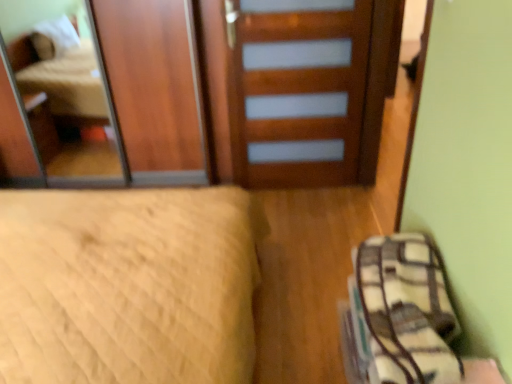
You are a GUI agent. You are given a task and a screenshot of the screen. Output one action in this format:
    pyautogui.click(x=<x>, y=<y>)
    Task: Click on the beige quilted bed at lower left
    The height and width of the screenshot is (384, 512).
    Given the screenshot: What is the action you would take?
    pyautogui.click(x=127, y=286)

Image resolution: width=512 pixels, height=384 pixels. What do you see at coordinates (56, 98) in the screenshot? I see `wooden mirror at upper left` at bounding box center [56, 98].

What do you see at coordinates (297, 90) in the screenshot?
I see `wooden door at center` at bounding box center [297, 90].

Where is `wooden door at center`? The width and height of the screenshot is (512, 384). wooden door at center is located at coordinates (297, 90).

Find the location of a particular element. The image size is (512, 384). beige quilted bed at lower left is located at coordinates (127, 286).

Considering the positions of objects beige quilted bed at lower left and plaid fabric bag at lower right in the image provided, who is more to the right, beige quilted bed at lower left or plaid fabric bag at lower right?

plaid fabric bag at lower right is more to the right.

Is beige quilted bed at lower left far away from plaid fabric bag at lower right?

No, beige quilted bed at lower left is not far away from plaid fabric bag at lower right.

Between beige quilted bed at lower left and plaid fabric bag at lower right, which one has more height?

Standing taller between the two is beige quilted bed at lower left.

In the scene shown: Considering the sizes of plaid fabric bag at lower right and wooden door at center in the image, is plaid fabric bag at lower right taller or shorter than wooden door at center?

In the image, plaid fabric bag at lower right appears to be shorter than wooden door at center.

Is plaid fabric bag at lower right aimed at wooden door at center?

No, plaid fabric bag at lower right is not facing towards wooden door at center.

Does plaid fabric bag at lower right appear on the left side of wooden door at center?

In fact, plaid fabric bag at lower right is to the right of wooden door at center.

From a real-world perspective, which is physically above, plaid fabric bag at lower right or wooden door at center?

In real-world perspective, wooden door at center is above.

Is beige quilted bed at lower left oriented towards wooden mirror at upper left?

No.

From the picture: Which point is more distant from viewer, (150, 252) or (23, 3)?

Point (23, 3)

Is the depth of beige quilted bed at lower left less than that of wooden mirror at upper left?

Yes.

Is beige quilted bed at lower left positioned far away from wooden door at center?

That's right, there is a large distance between beige quilted bed at lower left and wooden door at center.

Between beige quilted bed at lower left and wooden door at center, which one appears on the right side from the viewer's perspective?

wooden door at center.

Would you say wooden door at center is part of beige quilted bed at lower left's contents?

Actually, wooden door at center is outside beige quilted bed at lower left.

Looking at their sizes, would you say beige quilted bed at lower left is wider or thinner than wooden door at center?

Considering their sizes, beige quilted bed at lower left looks broader than wooden door at center.

Is plaid fabric bag at lower right far away from wooden mirror at upper left?

Yes.

Looking at their sizes, would you say plaid fabric bag at lower right is wider or thinner than wooden mirror at upper left?

Considering their sizes, plaid fabric bag at lower right looks broader than wooden mirror at upper left.

In the scene shown: Could you tell me if plaid fabric bag at lower right is facing wooden mirror at upper left?

No.

From a real-world perspective, is plaid fabric bag at lower right beneath wooden mirror at upper left?

Yes.

From a real-world perspective, is wooden mirror at upper left under wooden door at center?

No, from a real-world perspective, wooden mirror at upper left is not below wooden door at center.

There is a wooden door at center. Where is `mirror above it (from a real-world perspective)`? This screenshot has width=512, height=384. mirror above it (from a real-world perspective) is located at coordinates [x=56, y=98].

Is the depth of wooden mirror at upper left less than that of wooden door at center?

No, wooden mirror at upper left is further to the viewer.

How many degrees apart are the facing directions of wooden mirror at upper left and beige quilted bed at lower left?

There is a 89.3-degree angle between the facing directions of wooden mirror at upper left and beige quilted bed at lower left.

Can you confirm if wooden mirror at upper left is thinner than beige quilted bed at lower left?

Correct, the width of wooden mirror at upper left is less than that of beige quilted bed at lower left.

From a real-world perspective, who is located lower, wooden mirror at upper left or beige quilted bed at lower left?

beige quilted bed at lower left.

Would you consider wooden mirror at upper left to be distant from beige quilted bed at lower left?

That's right, there is a large distance between wooden mirror at upper left and beige quilted bed at lower left.

Identify the location of material on the right of beige quilted bed at lower left. (404, 311).

Where is `door on the left side of plaid fabric bag at lower right`? The image size is (512, 384). door on the left side of plaid fabric bag at lower right is located at coordinates (297, 90).

From the picture: Estimate the real-world distances between objects in this image. Which object is further from wooden mirror at upper left, beige quilted bed at lower left or plaid fabric bag at lower right?

plaid fabric bag at lower right is further to wooden mirror at upper left.

Based on their spatial positions, is wooden mirror at upper left or beige quilted bed at lower left further from plaid fabric bag at lower right?

wooden mirror at upper left.

When comparing their distances from wooden mirror at upper left, does beige quilted bed at lower left or wooden door at center seem closer?

Based on the image, beige quilted bed at lower left appears to be nearer to wooden mirror at upper left.

Which object lies nearer to the anchor point beige quilted bed at lower left, plaid fabric bag at lower right or wooden door at center?

Among the two, plaid fabric bag at lower right is located nearer to beige quilted bed at lower left.

Estimate the real-world distances between objects in this image. Which object is closer to plaid fabric bag at lower right, wooden mirror at upper left or wooden door at center?

wooden door at center is closer to plaid fabric bag at lower right.

Consider the image. Looking at the image, which one is located closer to wooden door at center, plaid fabric bag at lower right or wooden mirror at upper left?

wooden mirror at upper left is positioned closer to the anchor wooden door at center.

Consider the image. Which object lies further to the anchor point beige quilted bed at lower left, wooden door at center or wooden mirror at upper left?

wooden mirror at upper left.

Based on their spatial positions, is wooden door at center or beige quilted bed at lower left closer to plaid fabric bag at lower right?

The object closer to plaid fabric bag at lower right is beige quilted bed at lower left.

Find the location of `door between wooden mirror at upper left and plaid fabric bag at lower right from left to right`. door between wooden mirror at upper left and plaid fabric bag at lower right from left to right is located at coordinates (297, 90).

Locate an element on the screen. material positioned between beige quilted bed at lower left and wooden door at center from near to far is located at coordinates (404, 311).

Locate an element on the screen. The height and width of the screenshot is (384, 512). door between beige quilted bed at lower left and wooden mirror at upper left from front to back is located at coordinates (297, 90).

Locate an element on the screen. The width and height of the screenshot is (512, 384). material between beige quilted bed at lower left and wooden mirror at upper left from front to back is located at coordinates (404, 311).